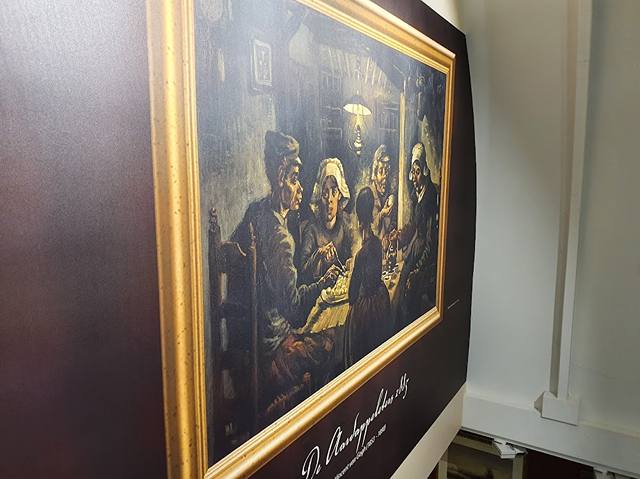
Where is `bottom gold area of frame`? The width and height of the screenshot is (640, 479). bottom gold area of frame is located at coordinates (342, 388).